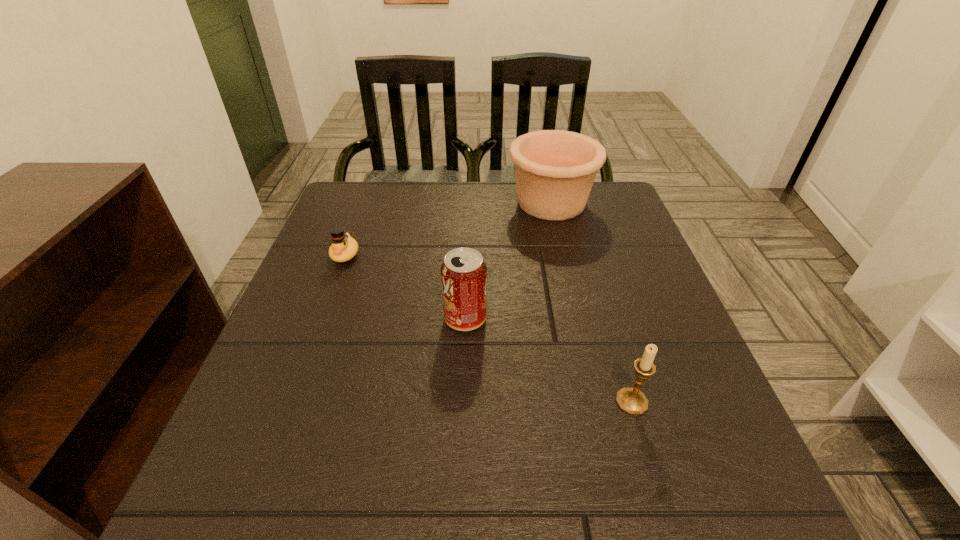
You are a GUI agent. You are given a task and a screenshot of the screen. Output one action in this format:
    pyautogui.click(x=<x>, y=<y>)
    Task: Click on the free space at the near left corner of the desktop
    This screenshot has height=540, width=960.
    Given the screenshot: What is the action you would take?
    pyautogui.click(x=302, y=477)

In the image, there is a desktop. Identify the location of blank space at the far right corner. (610, 189).

You are a GUI agent. You are given a task and a screenshot of the screen. Output one action in this format:
    pyautogui.click(x=<x>, y=<y>)
    Task: Click on the vacant space at the near right corner of the desktop
    
    Given the screenshot: What is the action you would take?
    pyautogui.click(x=708, y=494)

The width and height of the screenshot is (960, 540). Identify the location of vacant space in between the third farthest object and the pottery. (508, 261).

Identify the location of vacant space that's between the pottery and the second farthest object. This screenshot has width=960, height=540. (448, 229).

The width and height of the screenshot is (960, 540). Identify the location of vacant area that lies between the soda can and the duck. (405, 287).

Identify the location of free point between the pottery and the nearest object. The image size is (960, 540). (591, 302).

Locate an element on the screen. The image size is (960, 540). unoccupied position between the leftmost object and the farthest object is located at coordinates (448, 229).

The height and width of the screenshot is (540, 960). I want to click on free space between the soda can and the farthest object, so click(508, 261).

At what (x,y) coordinates should I click in order to perform the action: click on free spot between the duck and the farthest object. Please return your answer as a coordinate pair (x, y). The image size is (960, 540). Looking at the image, I should click on (448, 229).